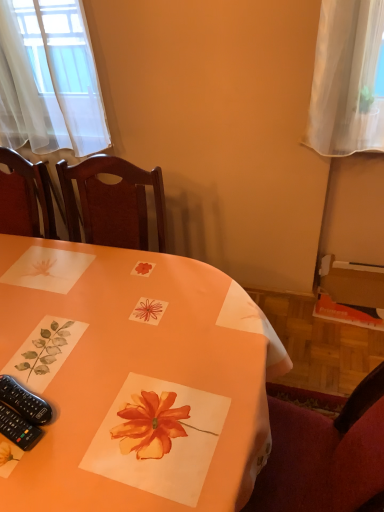
At what (x,y) coordinates should I click in order to perform the action: click on unoccupied space behind black plastic remote control at lower left, positioned as the second remote control in top-to-bottom order. Please return your answer as a coordinate pair (x, y). Looking at the image, I should click on (47, 353).